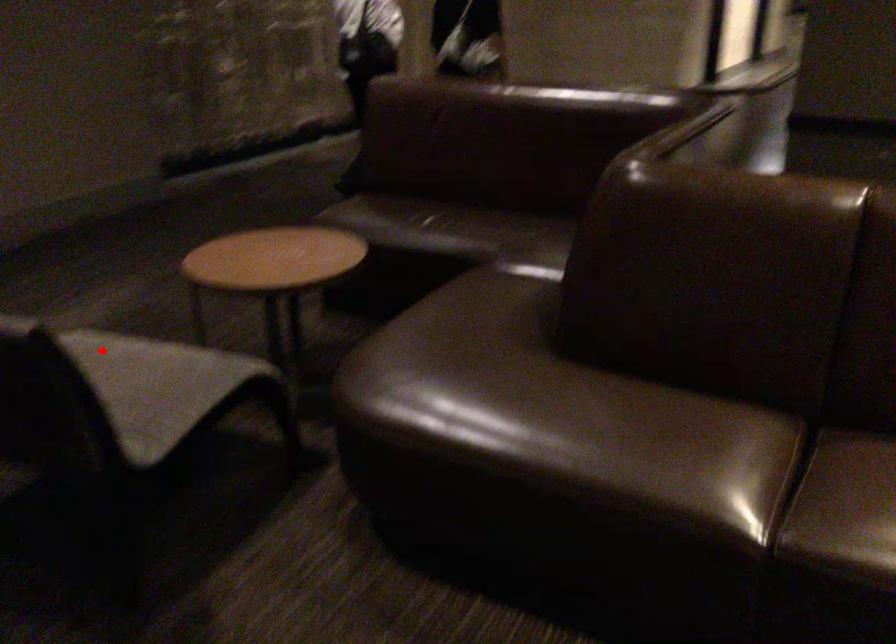
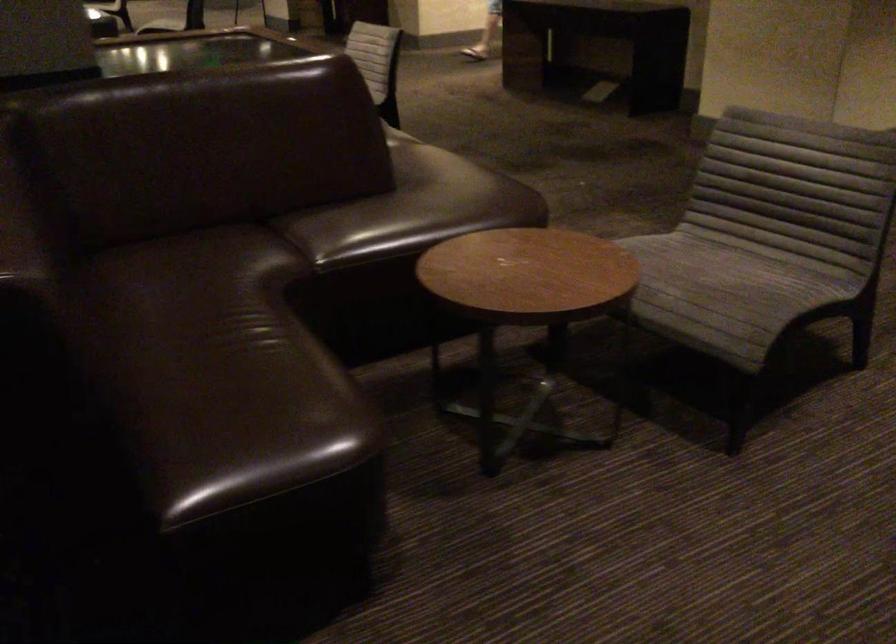
Find the pixel in the second image that matches the highlighted location in the first image.

(722, 286)